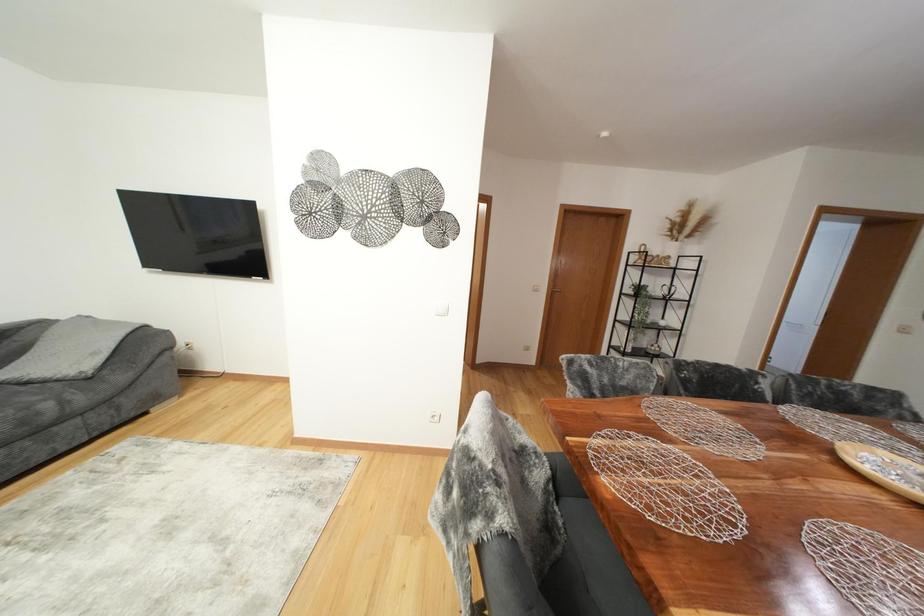
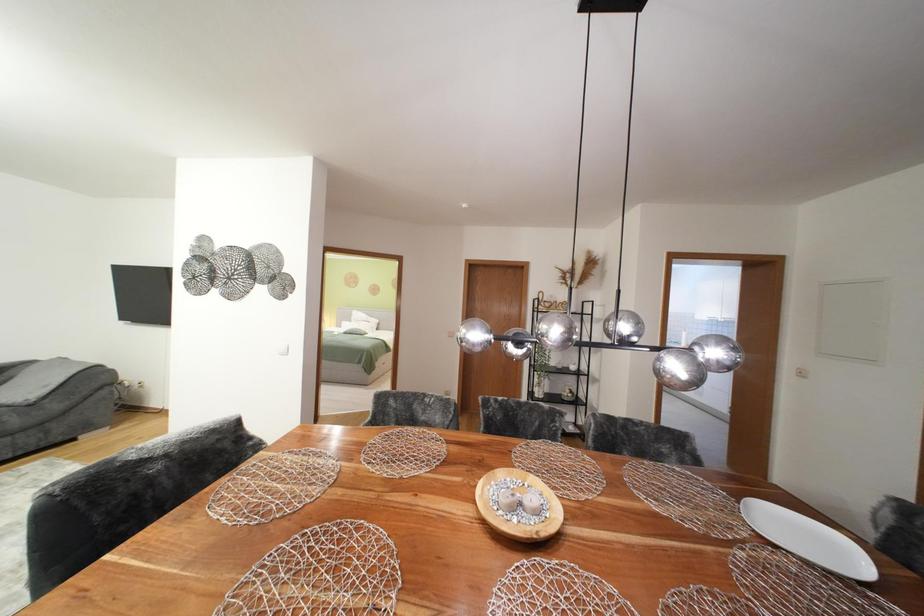
Question: In a continuous first-person perspective shot, in which direction is the camera moving?

Choices:
 (A) Left
 (B) Right
 (C) Forward
 (D) Backward

Answer: (B)